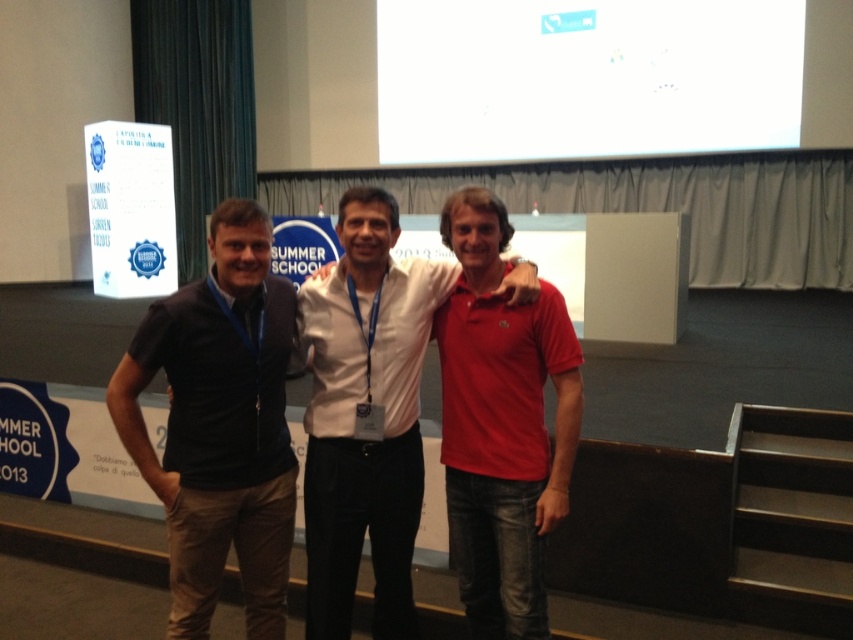
The height and width of the screenshot is (640, 853). Describe the element at coordinates (219, 426) in the screenshot. I see `dark blue jersey at left` at that location.

Locate an element on the screen. The height and width of the screenshot is (640, 853). dark blue jersey at left is located at coordinates (219, 426).

This screenshot has height=640, width=853. What do you see at coordinates (219, 426) in the screenshot?
I see `dark blue jersey at left` at bounding box center [219, 426].

This screenshot has height=640, width=853. I want to click on dark blue jersey at left, so click(219, 426).

Can you confirm if dark blue jersey at left is bigger than white cotton shirt at center?

Actually, dark blue jersey at left might be smaller than white cotton shirt at center.

Is point (225, 332) positioned before point (347, 524)?

Yes, it is in front of point (347, 524).

This screenshot has height=640, width=853. In order to click on dark blue jersey at left in this screenshot , I will do `click(219, 426)`.

This screenshot has width=853, height=640. What do you see at coordinates (585, 77) in the screenshot?
I see `white matte projection screen at upper center` at bounding box center [585, 77].

Based on the photo, can you confirm if white matte projection screen at upper center is taller than white cotton shirt at center?

Yes, white matte projection screen at upper center is taller than white cotton shirt at center.

Describe the element at coordinates (585, 77) in the screenshot. I see `white matte projection screen at upper center` at that location.

Where is `white matte projection screen at upper center`? The image size is (853, 640). white matte projection screen at upper center is located at coordinates (585, 77).